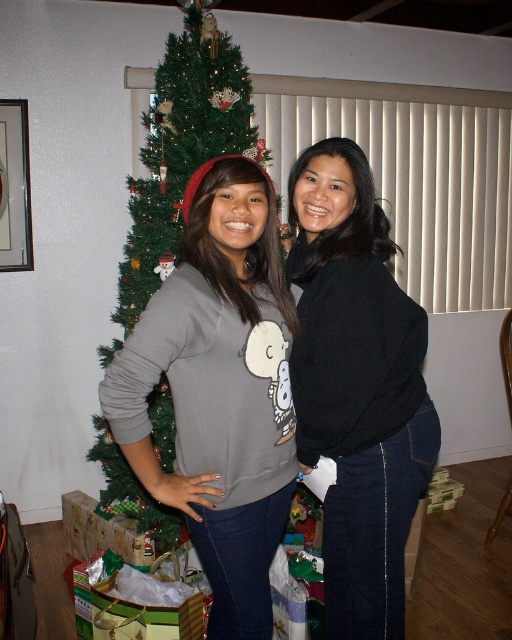
Question: Is green textured christmas tree at center bigger than green shiny wrapping paper at lower left?

Choices:
 (A) yes
 (B) no

Answer: (A)

Question: Estimate the real-world distances between objects in this image. Which object is farther from the black matte sweater at center?

Choices:
 (A) green textured christmas tree at center
 (B) green shiny wrapping paper at lower left

Answer: (A)

Question: Is green textured christmas tree at center to the right of green shiny wrapping paper at lower left from the viewer's perspective?

Choices:
 (A) no
 (B) yes

Answer: (B)

Question: Which object is farther from the camera taking this photo?

Choices:
 (A) green shiny wrapping paper at lower left
 (B) black matte sweater at center
 (C) green textured christmas tree at center

Answer: (C)

Question: Where is black matte sweater at center located in relation to green textured christmas tree at center in the image?

Choices:
 (A) below
 (B) above

Answer: (A)

Question: Which of the following is the closest to the observer?

Choices:
 (A) green shiny wrapping paper at lower left
 (B) black matte sweater at center
 (C) green textured christmas tree at center

Answer: (B)